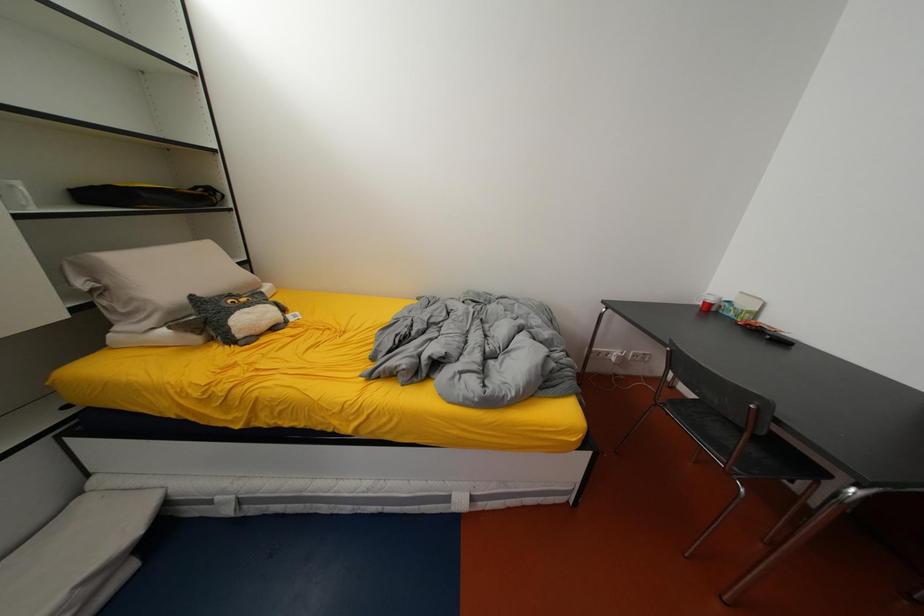
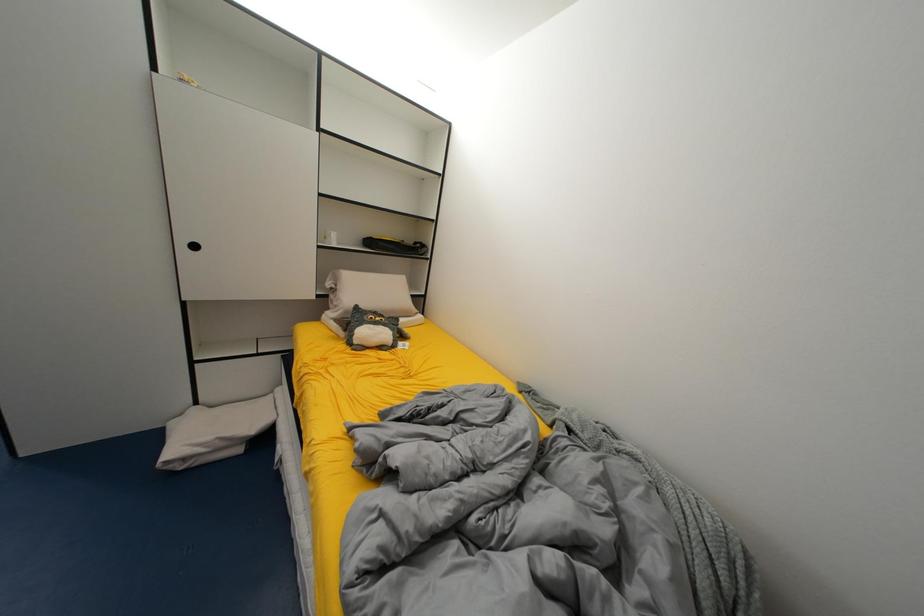
Question: The camera is either moving clockwise (left) or counter-clockwise (right) around the object. The first image is from the beginning of the video and the second image is from the end. Is the camera moving left or right when shooting the video?

Choices:
 (A) Left
 (B) Right

Answer: (B)